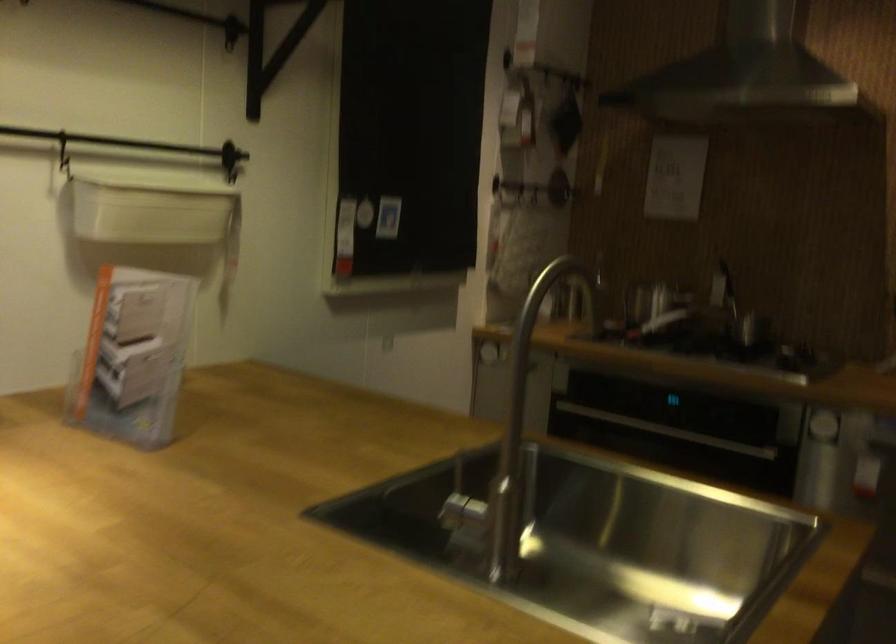
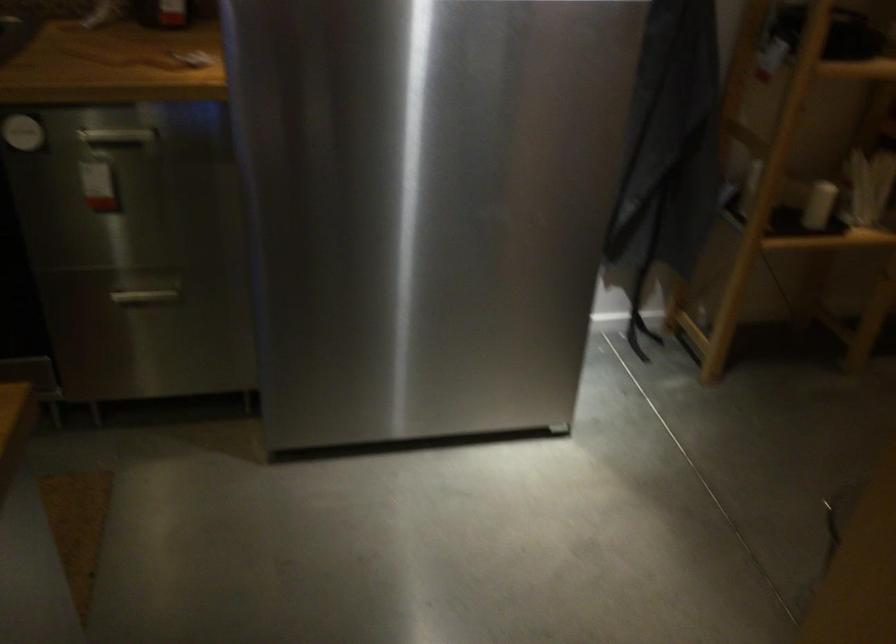
How did the camera likely rotate?

The camera's rotation is toward right-down.